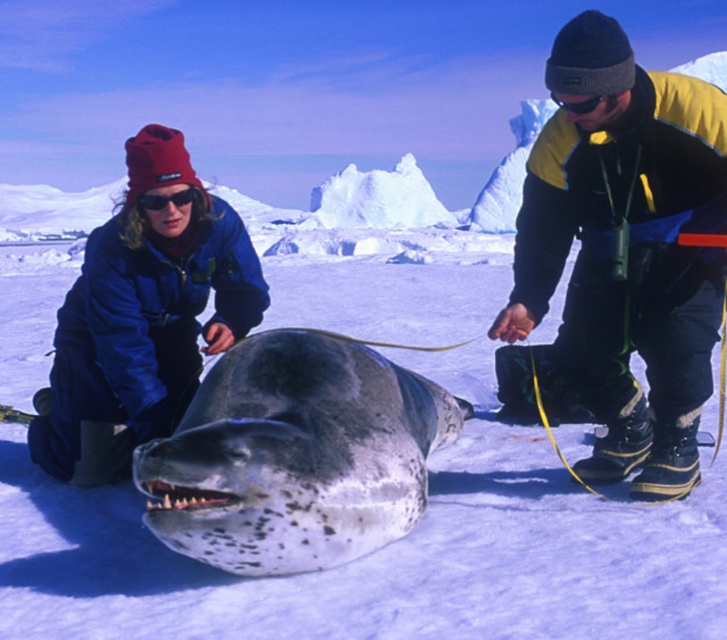
Question: Is the position of black fleece jacket at center less distant than that of speckled gray whale at center?

Choices:
 (A) no
 (B) yes

Answer: (A)

Question: Which is farther from the black fleece jacket at center?

Choices:
 (A) white ice at center
 (B) blue fleece jacket at center
 (C) speckled gray whale at center

Answer: (A)

Question: Which point appears farthest from the camera in this image?

Choices:
 (A) click(x=585, y=314)
 (B) click(x=393, y=221)

Answer: (B)

Question: Based on their relative distances, which object is nearer to the white ice at center?

Choices:
 (A) blue fleece jacket at center
 (B) black fleece jacket at center
 (C) speckled gray whale at center

Answer: (A)

Question: Does blue fleece jacket at center lie behind white ice at center?

Choices:
 (A) no
 (B) yes

Answer: (A)

Question: Does blue fleece jacket at center appear over white ice at center?

Choices:
 (A) yes
 (B) no

Answer: (B)